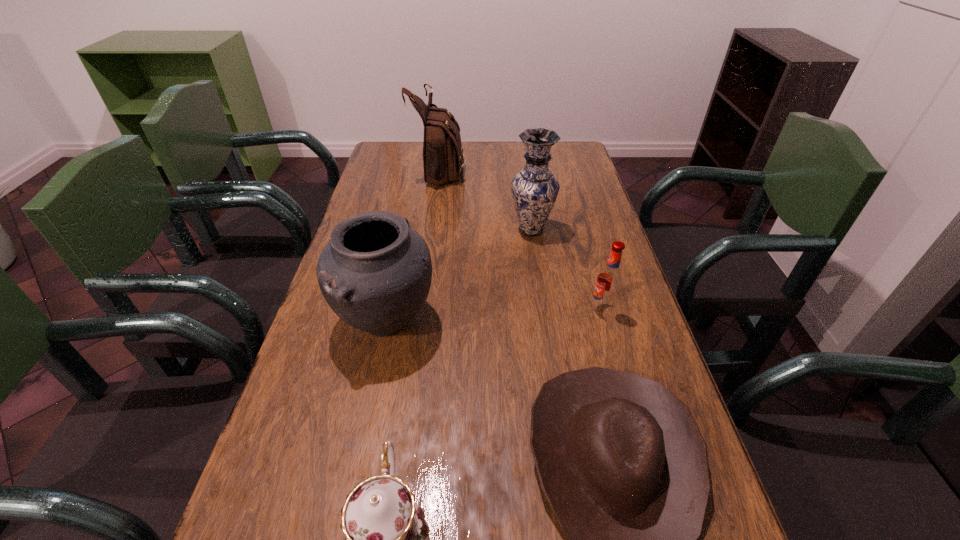
What are the coordinates of `the farthest object` in the screenshot? It's located at (443, 155).

Where is `vase`? Image resolution: width=960 pixels, height=540 pixels. vase is located at coordinates (534, 189).

Find the location of `urn`. urn is located at coordinates (375, 273).

Find the location of a particular element. The height and width of the screenshot is (540, 960). root beer is located at coordinates (609, 280).

This screenshot has width=960, height=540. I want to click on vacant space located on the front-facing side of the shoulder bag, so click(526, 169).

The image size is (960, 540). Find the location of `vacant space located on the back of the fifth nearest object`. vacant space located on the back of the fifth nearest object is located at coordinates (523, 172).

Find the location of `vacant point located 0.060m on the front of the urn`. vacant point located 0.060m on the front of the urn is located at coordinates (372, 390).

The height and width of the screenshot is (540, 960). Identify the location of free space located 0.360m on the front of the root beer. (647, 468).

Where is `object present at the far edge`? object present at the far edge is located at coordinates (443, 155).

At what (x,y) coordinates should I click in order to perform the action: click on shoulder bag that is at the left edge. Please return your answer as a coordinate pair (x, y). This screenshot has width=960, height=540. Looking at the image, I should click on (443, 155).